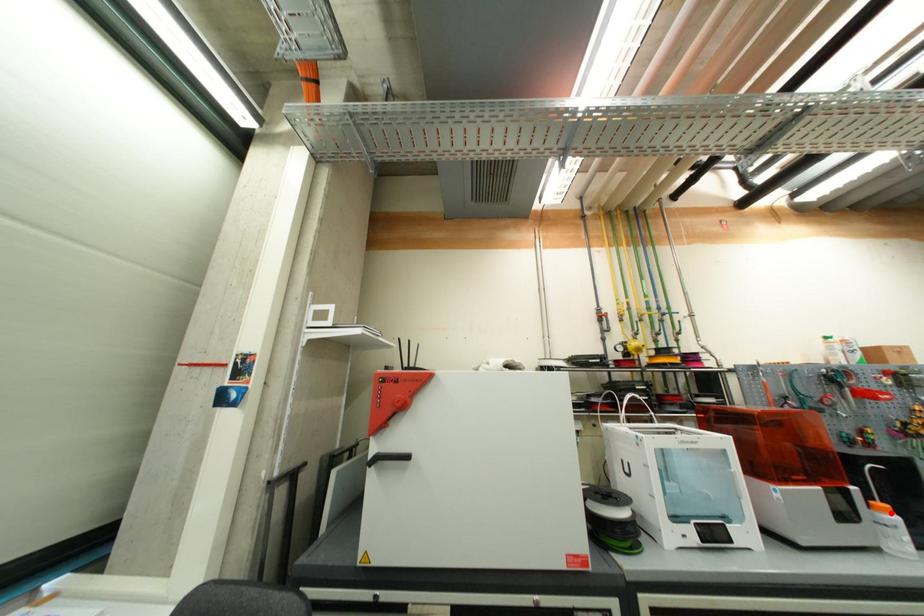
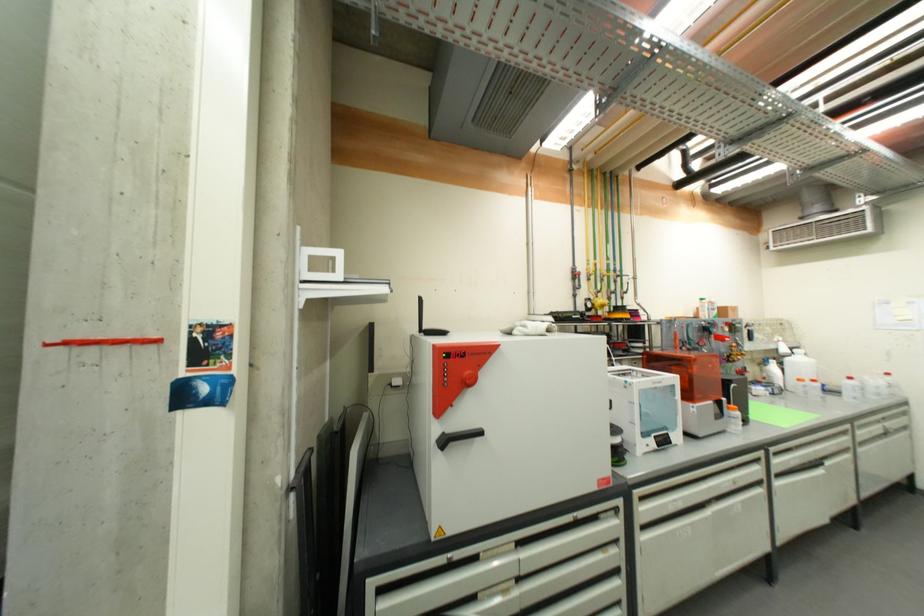
Find the pixel in the second image that matches the highlighted location in the first image.

(739, 411)